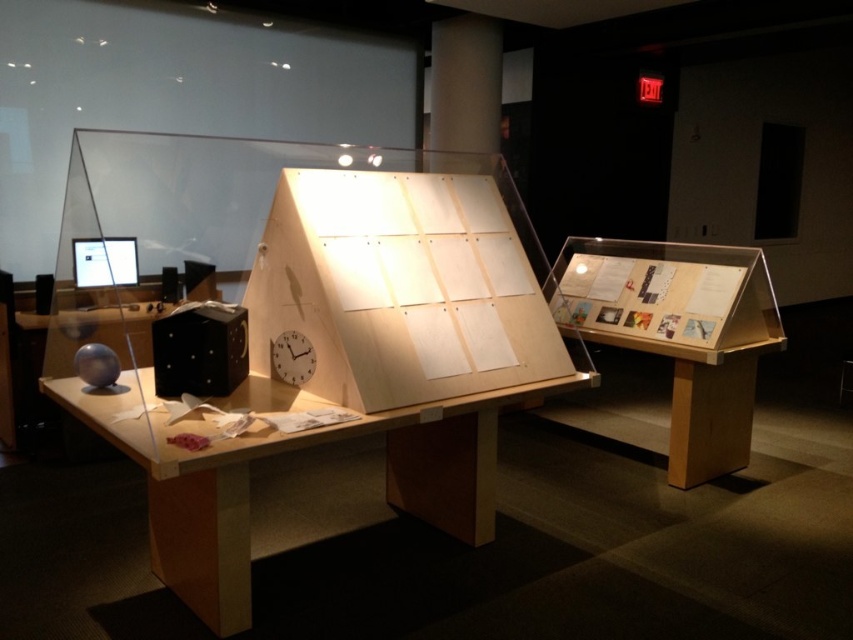
Is light brown wood table at center below wooden display case at right?

Yes.

Is the position of light brown wood table at center less distant than that of wooden display case at right?

Yes, light brown wood table at center is closer to the viewer.

What do you see at coordinates (297, 449) in the screenshot? Image resolution: width=853 pixels, height=640 pixels. I see `light brown wood table at center` at bounding box center [297, 449].

Find the location of a particular element. light brown wood table at center is located at coordinates (297, 449).

What do you see at coordinates (297, 449) in the screenshot? I see `light brown wood table at center` at bounding box center [297, 449].

Based on the photo, does light brown wood table at center lie in front of white matte clock at center?

Yes, it is.

Is point (456, 536) positioned after point (276, 376)?

Yes.

You are a GUI agent. You are given a task and a screenshot of the screen. Output one action in this format:
    pyautogui.click(x=<x>, y=<y>)
    Task: Click on the light brown wood table at center
    The width and height of the screenshot is (853, 640).
    Given the screenshot: What is the action you would take?
    [x=297, y=449]

Can you confirm if wooden display case at right is positioned to the right of white matte clock at center?

Yes, wooden display case at right is to the right of white matte clock at center.

Is wooden display case at right to the left of white matte clock at center from the viewer's perspective?

Incorrect, wooden display case at right is not on the left side of white matte clock at center.

Between point (578, 252) and point (276, 374), which one is positioned in front?

Point (276, 374) is in front.

Locate an element on the screen. This screenshot has height=640, width=853. wooden display case at right is located at coordinates (682, 333).